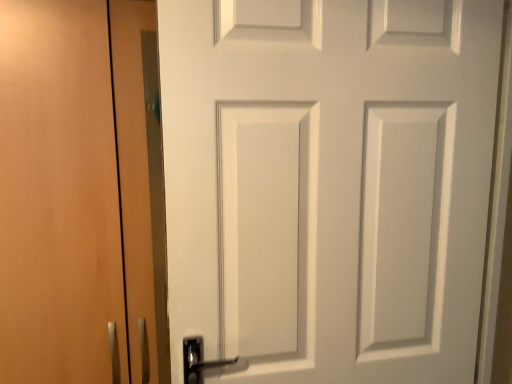
Question: Can you confirm if white matte door at center is positioned to the right of matte wood cabinet at left?

Choices:
 (A) no
 (B) yes

Answer: (B)

Question: From the image's perspective, does white matte door at center appear lower than matte wood cabinet at left?

Choices:
 (A) no
 (B) yes

Answer: (A)

Question: Is white matte door at center taller than matte wood cabinet at left?

Choices:
 (A) no
 (B) yes

Answer: (A)

Question: Is white matte door at center bigger than matte wood cabinet at left?

Choices:
 (A) no
 (B) yes

Answer: (A)

Question: Is white matte door at center placed right next to matte wood cabinet at left?

Choices:
 (A) no
 (B) yes

Answer: (A)

Question: Does white matte door at center have a lesser height compared to matte wood cabinet at left?

Choices:
 (A) no
 (B) yes

Answer: (B)

Question: Is matte wood cabinet at left further to the viewer compared to white matte door at center?

Choices:
 (A) yes
 (B) no

Answer: (A)

Question: From a real-world perspective, is matte wood cabinet at left over white matte door at center?

Choices:
 (A) no
 (B) yes

Answer: (A)

Question: Can you confirm if matte wood cabinet at left is bigger than white matte door at center?

Choices:
 (A) no
 (B) yes

Answer: (B)

Question: From the image's perspective, does matte wood cabinet at left appear higher than white matte door at center?

Choices:
 (A) yes
 (B) no

Answer: (B)

Question: Is matte wood cabinet at left at the right side of white matte door at center?

Choices:
 (A) yes
 (B) no

Answer: (B)

Question: Can you confirm if matte wood cabinet at left is wider than white matte door at center?

Choices:
 (A) yes
 (B) no

Answer: (A)

Question: Is matte wood cabinet at left inside the boundaries of white matte door at center, or outside?

Choices:
 (A) inside
 (B) outside

Answer: (B)